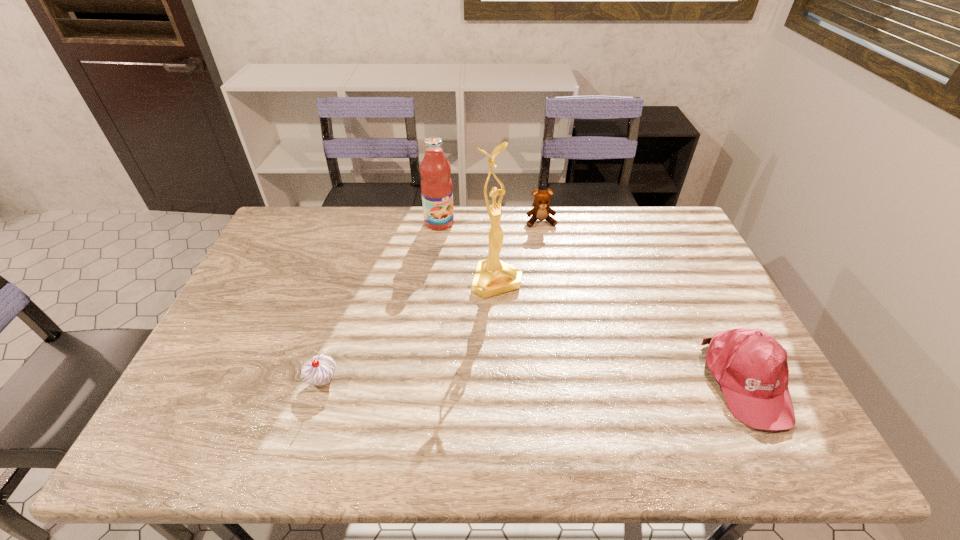
Image resolution: width=960 pixels, height=540 pixels. Find the location of `vacant space on the desktop that is between the cupcake and the rightmost object and is positioned on the front-facing side of the award`. vacant space on the desktop that is between the cupcake and the rightmost object and is positioned on the front-facing side of the award is located at coordinates (569, 381).

Identify the location of vacant space on the desktop that is between the cupcake and the rightmost object and is positioned on the front label of the fruit juice. (577, 381).

The height and width of the screenshot is (540, 960). Find the location of `free spot on the desktop that is between the cupcake and the baseball cap and is positioned on the front-facing side of the teddy bear`. free spot on the desktop that is between the cupcake and the baseball cap and is positioned on the front-facing side of the teddy bear is located at coordinates tap(583, 381).